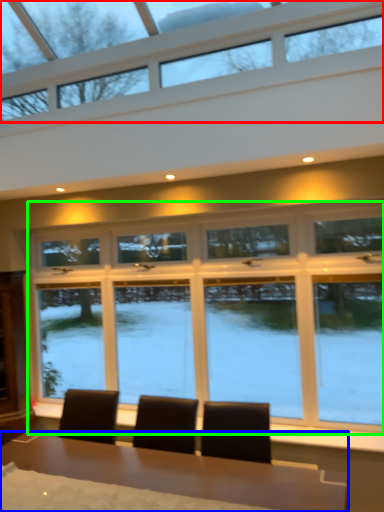
Question: Considering the real-world distances, which object is farthest from window (highlighted by a red box)? table (highlighted by a blue box) or window (highlighted by a green box)?

Choices:
 (A) table
 (B) window

Answer: (A)